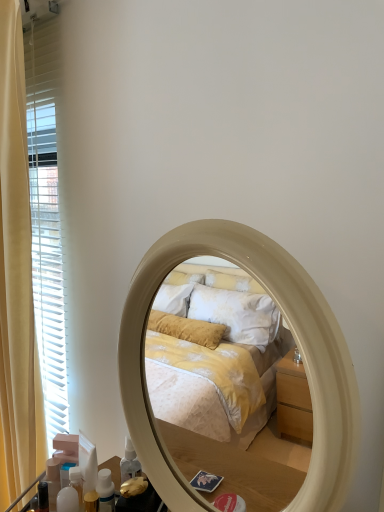
You are a GUI agent. You are given a task and a screenshot of the screen. Output one action in this format:
    pyautogui.click(x=<x>, y=<y>)
    Task: Click on the translucent plastic bottles at lower left, acting as the 2th toiletry starting from the back
    Image resolution: width=384 pixels, height=512 pixels.
    Given the screenshot: What is the action you would take?
    pyautogui.click(x=71, y=492)

What do you see at coordinates (53, 481) in the screenshot?
I see `translucent plastic bottle at lower left, arranged as the 2th toiletry when viewed from the front` at bounding box center [53, 481].

Describe the element at coordinates (17, 278) in the screenshot. The image size is (384, 512). I see `yellow fabric curtain at left` at that location.

This screenshot has height=512, width=384. I want to click on translucent plastic bottles at lower left, the 2th toiletry viewed from the left, so click(x=71, y=492).

From a real-world perspective, is beige glossy mirror at center on yellow fabric curtain at left?

No.

At what (x,y) coordinates should I click in order to perform the action: click on curtain on the left of beige glossy mirror at center. Please return your answer as a coordinate pair (x, y). Looking at the image, I should click on (17, 278).

Considering the sizes of beige glossy mirror at center and yellow fabric curtain at left in the image, is beige glossy mirror at center bigger or smaller than yellow fabric curtain at left?

Considering their sizes, beige glossy mirror at center takes up less space than yellow fabric curtain at left.

Consider the image. Can you see translucent plastic bottle at lower left, arranged as the 2th toiletry when viewed from the front, touching beige glossy mirror at center?

They are not placed beside each other.

From the image's perspective, is translucent plastic bottle at lower left, the first toiletry viewed from the left, below beige glossy mirror at center?

Correct, translucent plastic bottle at lower left, the first toiletry viewed from the left, appears lower than beige glossy mirror at center in the image.

How different are the orientations of translucent plastic bottle at lower left, the first toiletry positioned from the back, and beige glossy mirror at center in degrees?

13.9 degrees separate the facing orientations of translucent plastic bottle at lower left, the first toiletry positioned from the back, and beige glossy mirror at center.

From a real-world perspective, is translucent plastic bottle at lower left, placed as the second toiletry when sorted from right to left, above or below beige glossy mirror at center?

translucent plastic bottle at lower left, placed as the second toiletry when sorted from right to left, is below beige glossy mirror at center.

Considering the points (81, 500) and (54, 496), which point is in front, point (81, 500) or point (54, 496)?

The point (54, 496) is closer to the camera.

Are translucent plastic bottles at lower left, the 1th toiletry from the right, and translucent plastic bottle at lower left, the first toiletry positioned from the back, beside each other?

Yes, translucent plastic bottles at lower left, the 1th toiletry from the right, is with translucent plastic bottle at lower left, the first toiletry positioned from the back.

Between translucent plastic bottles at lower left, the 2th toiletry viewed from the left, and translucent plastic bottle at lower left, placed as the second toiletry when sorted from right to left, which one has more height?

Standing taller between the two is translucent plastic bottle at lower left, placed as the second toiletry when sorted from right to left.

Is yellow fabric curtain at left bigger than translucent plastic bottles at lower left, acting as the first toiletry starting from the front?

Correct, yellow fabric curtain at left is larger in size than translucent plastic bottles at lower left, acting as the first toiletry starting from the front.

From the image's perspective, would you say yellow fabric curtain at left is shown under translucent plastic bottles at lower left, the 2th toiletry viewed from the left?

Incorrect, from the image's perspective, yellow fabric curtain at left is higher than translucent plastic bottles at lower left, the 2th toiletry viewed from the left.

The height and width of the screenshot is (512, 384). In order to click on curtain behind the translucent plastic bottles at lower left, the 2th toiletry viewed from the left in this screenshot , I will do `click(17, 278)`.

Considering the relative sizes of yellow fabric curtain at left and translucent plastic bottles at lower left, acting as the first toiletry starting from the front, in the image provided, is yellow fabric curtain at left thinner than translucent plastic bottles at lower left, acting as the first toiletry starting from the front,?

No.

Are translucent plastic bottles at lower left, the 1th toiletry from the right, and beige glossy mirror at center beside each other?

There is a gap between translucent plastic bottles at lower left, the 1th toiletry from the right, and beige glossy mirror at center.

Is translucent plastic bottles at lower left, acting as the 2th toiletry starting from the back, oriented away from beige glossy mirror at center?

No, beige glossy mirror at center is not at the back of translucent plastic bottles at lower left, acting as the 2th toiletry starting from the back.

Considering the points (64, 509) and (337, 337), which point is behind, point (64, 509) or point (337, 337)?

Point (64, 509)

Is translucent plastic bottles at lower left, acting as the 2th toiletry starting from the back, outside of beige glossy mirror at center?

translucent plastic bottles at lower left, acting as the 2th toiletry starting from the back, is positioned outside beige glossy mirror at center.

Consider the image. Can you tell me how much beige glossy mirror at center and translucent plastic bottle at lower left, placed as the second toiletry when sorted from right to left, differ in facing direction?

The angle between the facing direction of beige glossy mirror at center and the facing direction of translucent plastic bottle at lower left, placed as the second toiletry when sorted from right to left, is 13.9 degrees.

Which object is further away from the camera, beige glossy mirror at center or translucent plastic bottle at lower left, the first toiletry positioned from the back?

translucent plastic bottle at lower left, the first toiletry positioned from the back, is further away from the camera.

Considering the positions of points (324, 476) and (49, 507), is point (324, 476) closer to camera compared to point (49, 507)?

Yes, it is in front of point (49, 507).

From the image's perspective, which one is positioned higher, beige glossy mirror at center or translucent plastic bottle at lower left, placed as the second toiletry when sorted from right to left?

From the image's view, beige glossy mirror at center is above.

Could you tell me if yellow fabric curtain at left is turned towards beige glossy mirror at center?

No, yellow fabric curtain at left is not aimed at beige glossy mirror at center.

Is yellow fabric curtain at left to the left or to the right of beige glossy mirror at center in the image?

yellow fabric curtain at left is to the left of beige glossy mirror at center.

Between yellow fabric curtain at left and beige glossy mirror at center, which one has larger width?

yellow fabric curtain at left.

This screenshot has width=384, height=512. I want to click on mirror lying below the yellow fabric curtain at left (from the image's perspective), so click(x=294, y=337).

There is a beige glossy mirror at center. Where is `the 2nd toiletry below it (from a real-world perspective)`? the 2nd toiletry below it (from a real-world perspective) is located at coordinates (53, 481).

Estimate the real-world distances between objects in this image. Which object is further from translucent plastic bottles at lower left, acting as the first toiletry starting from the front, yellow fabric curtain at left or beige glossy mirror at center?

yellow fabric curtain at left lies further to translucent plastic bottles at lower left, acting as the first toiletry starting from the front, than the other object.

Looking at the image, which one is located closer to yellow fabric curtain at left, translucent plastic bottles at lower left, acting as the first toiletry starting from the front, or beige glossy mirror at center?

translucent plastic bottles at lower left, acting as the first toiletry starting from the front, lies closer to yellow fabric curtain at left than the other object.

When comparing their distances from beige glossy mirror at center, does translucent plastic bottles at lower left, the 1th toiletry from the right, or yellow fabric curtain at left seem closer?

translucent plastic bottles at lower left, the 1th toiletry from the right.

Based on their spatial positions, is translucent plastic bottle at lower left, the first toiletry positioned from the back, or yellow fabric curtain at left further from translucent plastic bottles at lower left, the 2th toiletry viewed from the left?

The object further to translucent plastic bottles at lower left, the 2th toiletry viewed from the left, is yellow fabric curtain at left.

Which object lies nearer to the anchor point beige glossy mirror at center, translucent plastic bottles at lower left, acting as the 2th toiletry starting from the back, or translucent plastic bottle at lower left, arranged as the 2th toiletry when viewed from the front?

The object closer to beige glossy mirror at center is translucent plastic bottles at lower left, acting as the 2th toiletry starting from the back.

From the picture: Based on their spatial positions, is translucent plastic bottle at lower left, the first toiletry positioned from the back, or translucent plastic bottles at lower left, acting as the 2th toiletry starting from the back, closer to beige glossy mirror at center?

translucent plastic bottles at lower left, acting as the 2th toiletry starting from the back, is closer to beige glossy mirror at center.

Considering their positions, is beige glossy mirror at center positioned closer to translucent plastic bottle at lower left, placed as the second toiletry when sorted from right to left, than translucent plastic bottles at lower left, the 2th toiletry viewed from the left?

Among the two, translucent plastic bottles at lower left, the 2th toiletry viewed from the left, is located nearer to translucent plastic bottle at lower left, placed as the second toiletry when sorted from right to left.

Looking at the image, which one is located further to translucent plastic bottles at lower left, the 2th toiletry viewed from the left, beige glossy mirror at center or translucent plastic bottle at lower left, the first toiletry viewed from the left?

beige glossy mirror at center is further to translucent plastic bottles at lower left, the 2th toiletry viewed from the left.

This screenshot has height=512, width=384. Find the location of `toiletry between beige glossy mirror at center and translucent plastic bottle at lower left, arranged as the 2th toiletry when viewed from the front, along the z-axis`. toiletry between beige glossy mirror at center and translucent plastic bottle at lower left, arranged as the 2th toiletry when viewed from the front, along the z-axis is located at coordinates (71, 492).

The image size is (384, 512). Identify the location of toiletry between yellow fabric curtain at left and translucent plastic bottles at lower left, acting as the 2th toiletry starting from the back, from top to bottom. (53, 481).